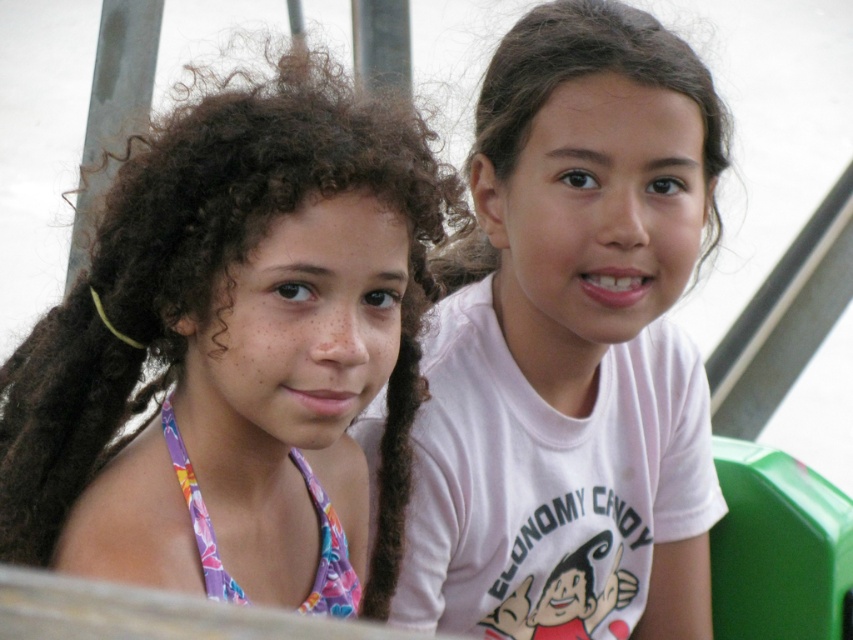
You are a photographer setting up a shoot for a fashion magazine. You want to ensure that both the matte purple swimsuit at left and the white matte shirt at center are clearly visible in the photo. Based on their positions, which clothing item should you focus on first to ensure proper lighting?

The matte purple swimsuit at left is located below the white matte shirt at center. Since it is lower in the frame, you should focus on the white matte shirt at center first to ensure it is well lit before adjusting for the lower positioned matte purple swimsuit at left.